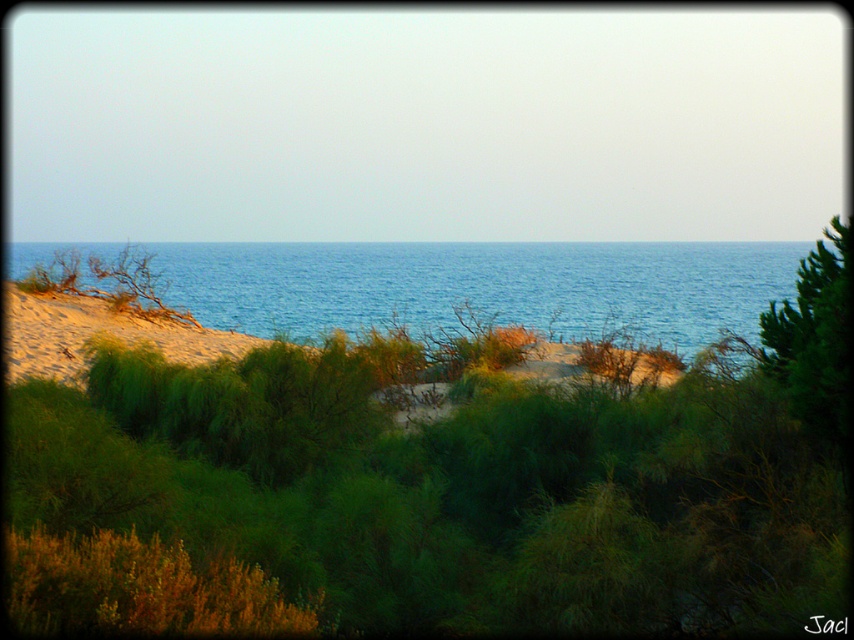
Does blue water at center lie behind sandy beach at left?

No, blue water at center is in front of sandy beach at left.

Looking at this image, who is more distant from viewer, (664, 253) or (106, 314)?

The point (664, 253) is more distant.

Find the location of a particular element. blue water at center is located at coordinates (483, 285).